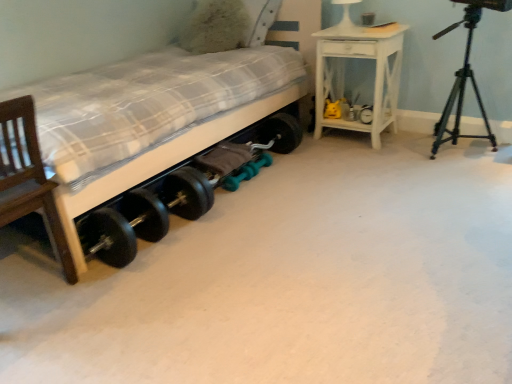
Find the location of a particular element. The width and height of the screenshot is (512, 384). vacant space in front of wooden bed at lower left is located at coordinates (260, 284).